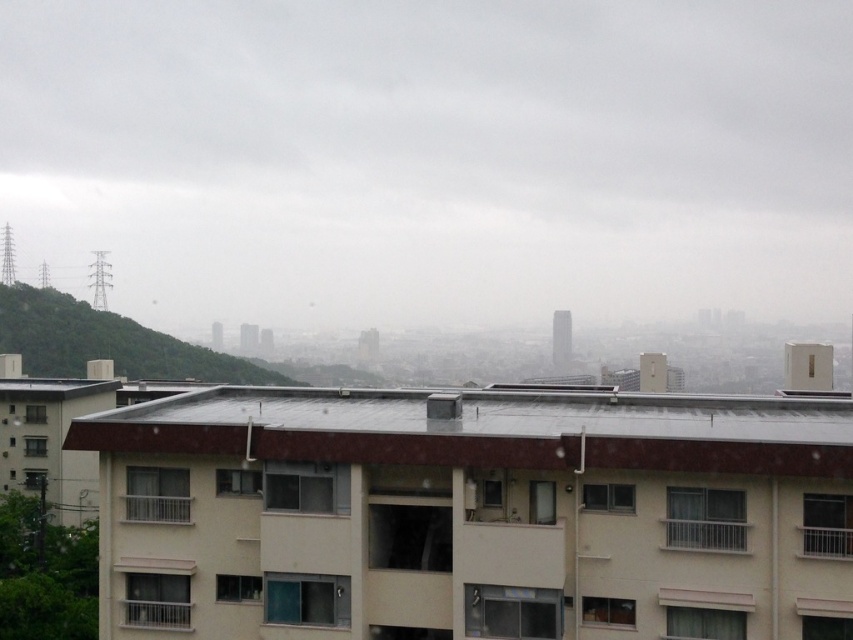
You are standing in the urban landscape and want to take a photo of the smooth gray roof at center and the green leafy hillside at left. Which object should you focus on first to ensure both are in the same frame?

You should focus on the smooth gray roof at center first because it is closer to the viewer than the green leafy hillside at left, so adjusting focus from near to far will help capture both in the same frame.